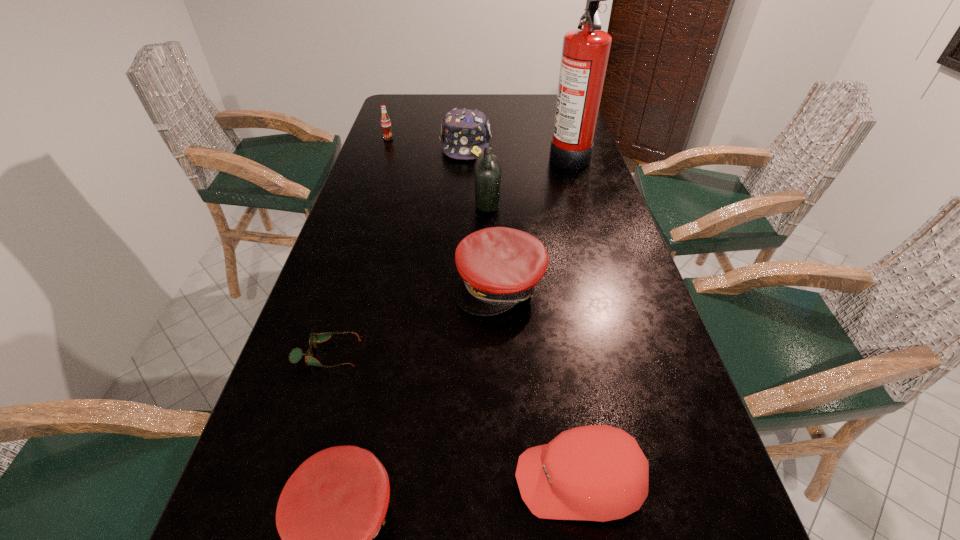
Where is `cap identified as the closest to the second farthest cap`? The height and width of the screenshot is (540, 960). cap identified as the closest to the second farthest cap is located at coordinates (599, 473).

Image resolution: width=960 pixels, height=540 pixels. I want to click on cap that is the nearest to the farthest cap, so click(x=499, y=267).

Find the location of `free space that satisfies the following two spatial constraints: 1. on the front-facing side of the third nearest cap; 2. on the front-facing side of the shortest object`. free space that satisfies the following two spatial constraints: 1. on the front-facing side of the third nearest cap; 2. on the front-facing side of the shortest object is located at coordinates (x=503, y=354).

Image resolution: width=960 pixels, height=540 pixels. Identify the location of free spot that satisfies the following two spatial constraints: 1. on the front-facing side of the third nearest cap; 2. on the front-facing side of the shortest object. (503, 354).